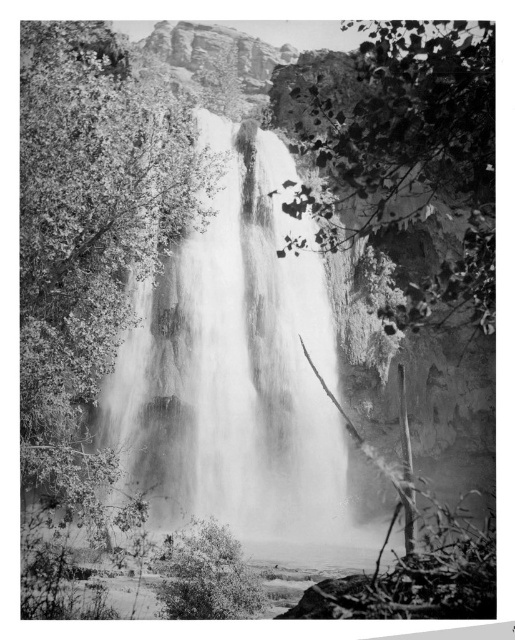
You are a photographer analyzing the composition of this waterfall scene. Which object between the smooth green tree at center and the leaves at center takes up more area in the image?

The leaves at center take up more area than the smooth green tree at center, as the smooth green tree at center occupies less space than leaves at center.

You are standing in front of the waterfall scene. You notice the smooth white water at center and the leaves at center. Which object is positioned lower in the image?

The smooth white water at center is positioned lower than the leaves at center.

You are a photographer standing at the base of the waterfall. You want to take a closeup photo of the smooth green tree at center. Given that your camera has a maximum zoom range of 100 feet, can you capture the tree without moving closer?

The smooth green tree at center is 191.18 feet away from camera, which exceeds the camera maximum zoom range of 100 feet. Therefore, you cannot capture the tree without moving closer.